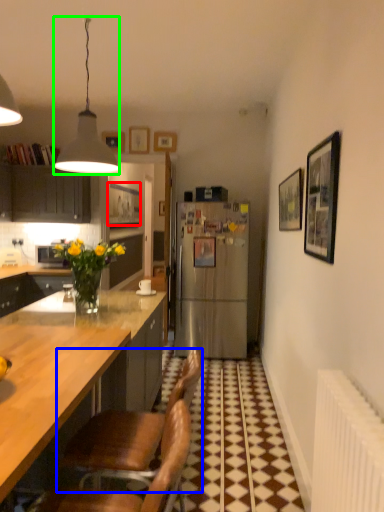
Question: Based on their relative distances, which object is farther from picture frame (highlighted by a red box)? Choose from chair (highlighted by a blue box) and lamp (highlighted by a green box).

Choices:
 (A) chair
 (B) lamp

Answer: (A)